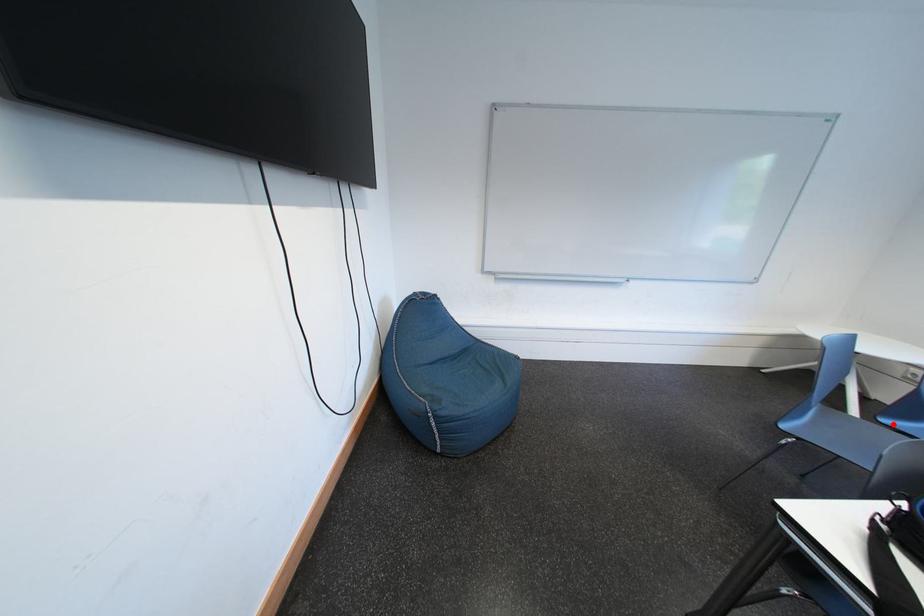
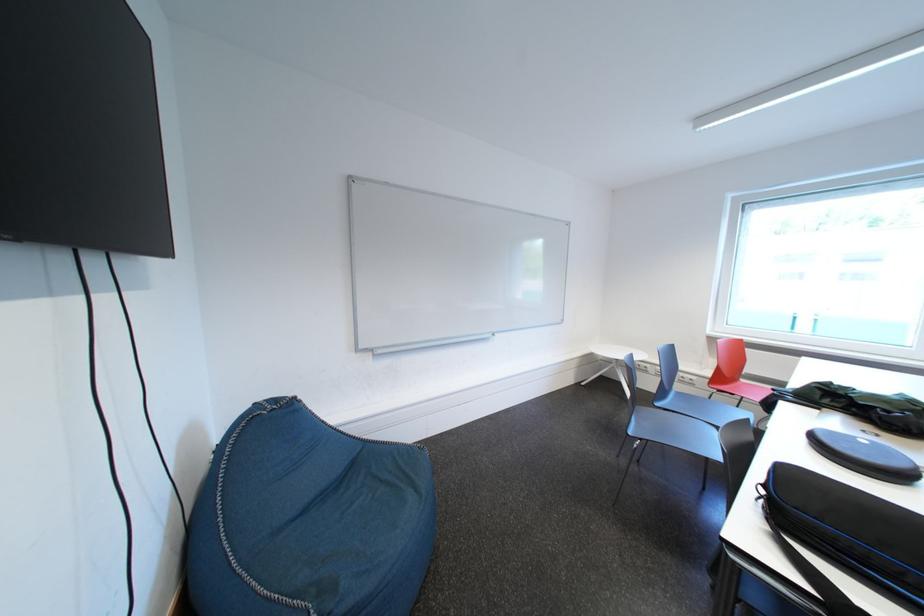
Question: I am providing you with two images of the same scene from different viewpoints. In image1, a red point is highlighted. Considering the same 3D point in image2, which of the following is correct?

Choices:
 (A) It is closer
 (B) It is farther

Answer: (A)